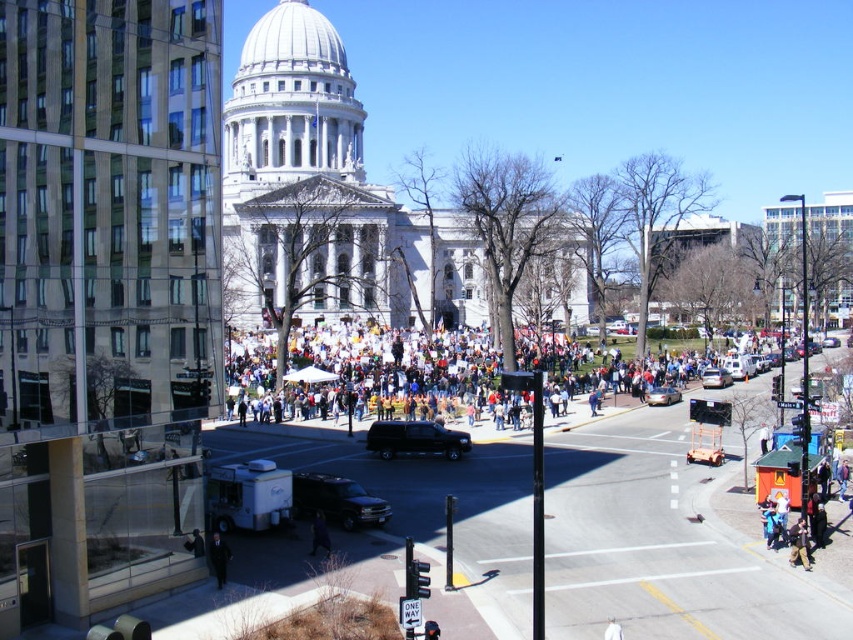
You are standing at point (186, 540) and want to walk to point (573, 349). Given the scene described, is your path blocked by the crowd near the historic building?

Point (573, 349) is behind point (186, 540), so the path to point (573, 349) would be blocked by the crowd near the historic building located at point (186, 540).

You are a delivery person trying to navigate through the busy street. You see the black glossy suv at center and the dark fabric coat at lower center. Which object is taller?

The black glossy suv at center is taller than the dark fabric coat at lower center according to the description.

You are a tourist standing at the intersection and want to take a photo of the historic building. However, there are two obstacles in your view. The white cloth crowd at center and the dark fabric coat at lower center. Which obstacle is closer to you so you can ask them to move first?

The dark fabric coat at lower center is closer to you because it is positioned to the left of the white cloth crowd at center, which is further away to the right side of it.